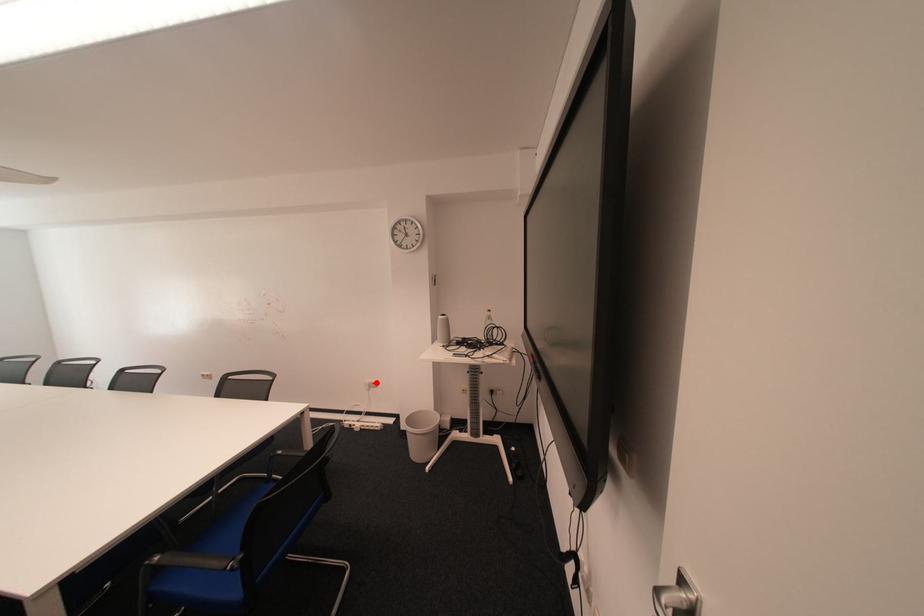
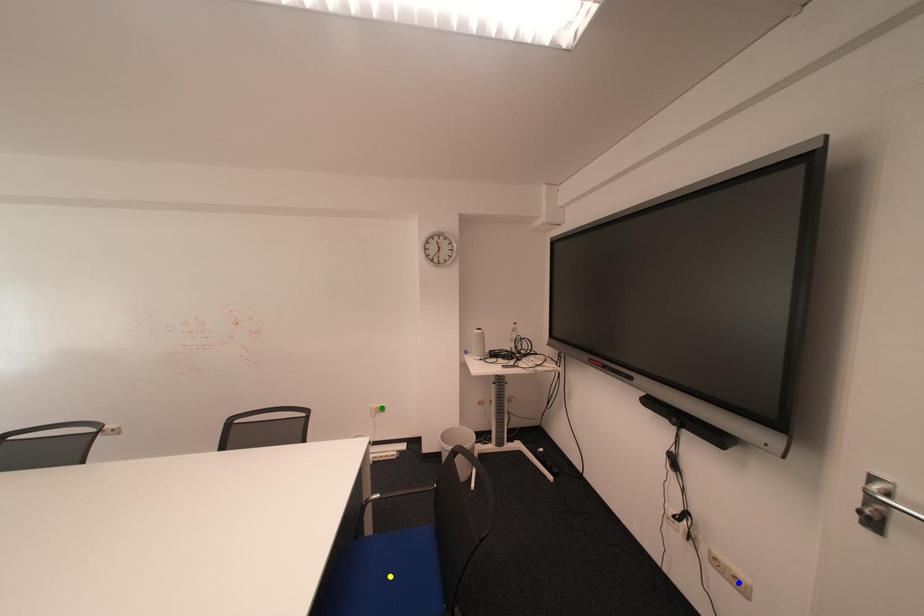
Question: I am providing you with two images of the same scene from different viewpoints. A red point is marked on the first image. You are given multiple points on the second image. Can you choose the point in image 2 that corresponds to the point in image 1?

Choices:
 (A) green point
 (B) yellow point
 (C) blue point

Answer: (A)